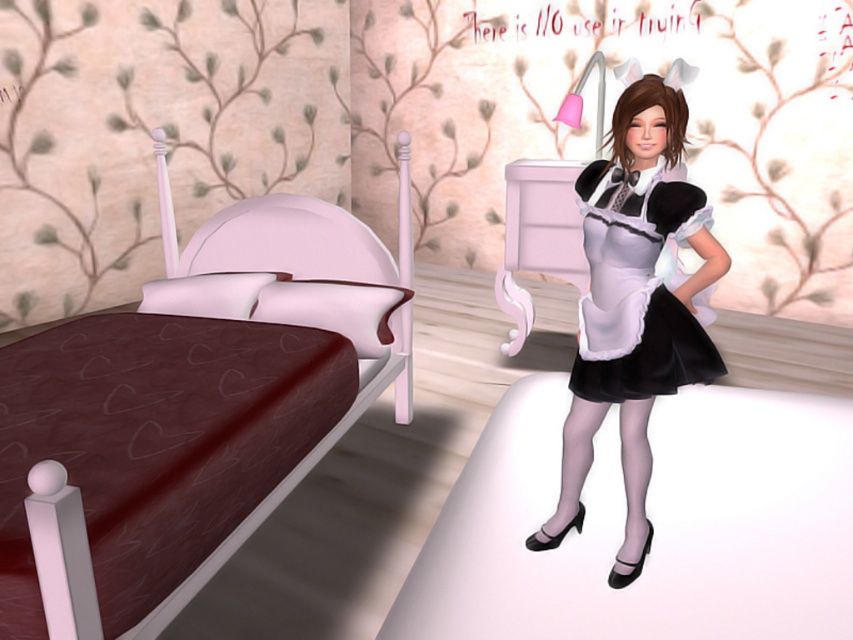
You are standing in the bedroom scene and want to know how far the point at coordinates (258, 369) is from you. Can you determine the distance?

The point at coordinates (258, 369) is 2.12 meters from the viewer.

You are a guest in this bedroom and want to sit on the brown fabric bed at center. However, there is a matte black maid outfit at center in the way. Can you sit down without moving the outfit?

The brown fabric bed at center is taller than the matte black maid outfit at center, so you can sit on the bed without moving the outfit as it is taller and likely elevated above the maid outfit.

What are the coordinates of the matte black maid outfit at center in the image?

The coordinates of the matte black maid outfit at center are at point (x=634, y=307).